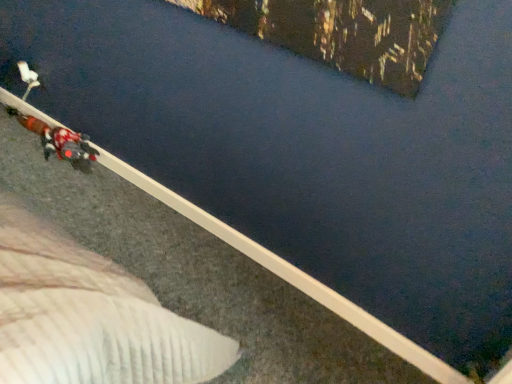
Question: Is velvet-like red coat at lower left in front of or behind white plush toy at upper left in the image?

Choices:
 (A) behind
 (B) front

Answer: (B)

Question: Looking at the image, does velvet-like red coat at lower left seem bigger or smaller compared to white plush toy at upper left?

Choices:
 (A) small
 (B) big

Answer: (B)

Question: From the image's perspective, relative to white plush toy at upper left, is velvet-like red coat at lower left above or below?

Choices:
 (A) above
 (B) below

Answer: (B)

Question: Is white plush toy at upper left to the left or to the right of velvet-like red coat at lower left in the image?

Choices:
 (A) right
 (B) left

Answer: (B)

Question: From the image's perspective, is white plush toy at upper left positioned above or below velvet-like red coat at lower left?

Choices:
 (A) above
 (B) below

Answer: (A)

Question: Looking at the image, does white plush toy at upper left seem bigger or smaller compared to velvet-like red coat at lower left?

Choices:
 (A) small
 (B) big

Answer: (A)

Question: Is point (26, 67) positioned closer to the camera than point (84, 142)?

Choices:
 (A) farther
 (B) closer

Answer: (B)